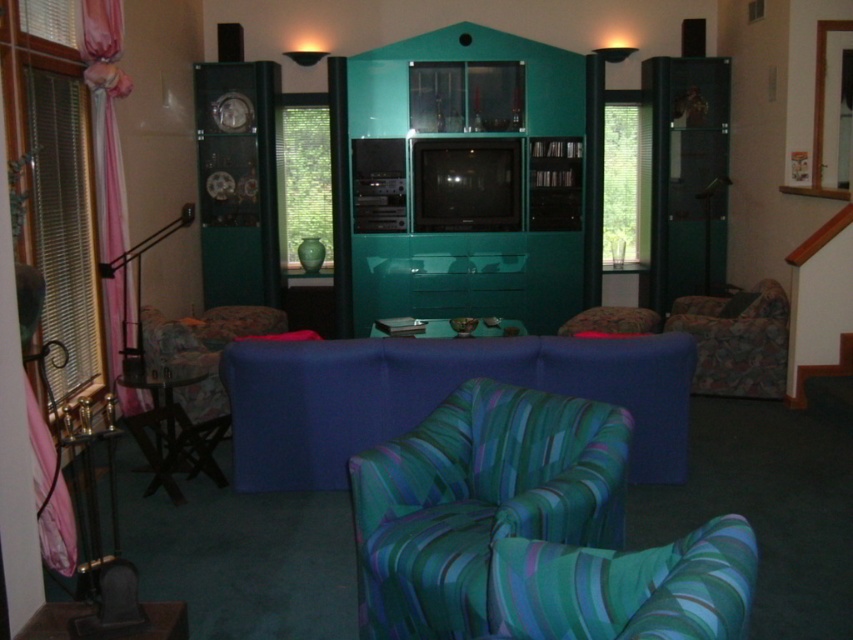
What is the color of the fabric of the armchair located at the point with coordinates (479, 500)?

The point at coordinates (479, 500) marks the green striped fabric armchair at lower center, so its fabric is green striped.

You are sitting on the blue sofa and want to place a metallic silver tray at center on the green striped fabric armchair at lower center. Is the tray currently positioned to the right or left of the armchair?

The green striped fabric armchair at lower center is to the right of the metallic silver tray at center, so the tray is currently positioned to the left of the armchair.

You are planning to place a new decorative item on the green striped fabric chair at lower center and the teal glossy vase at center. Considering their sizes, which object can accommodate a larger item?

The green striped fabric chair at lower center has a larger size compared to the teal glossy vase at center, so it can accommodate a larger item.